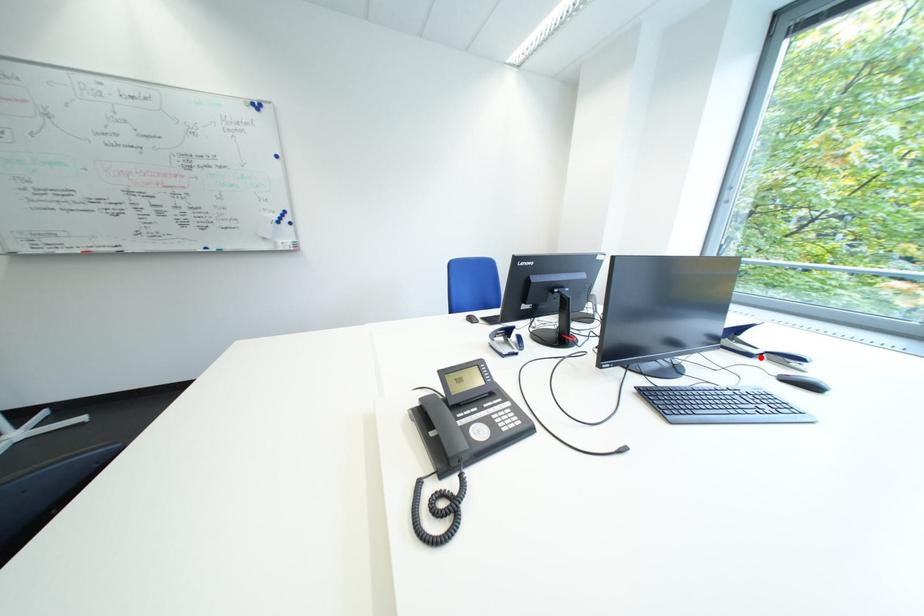
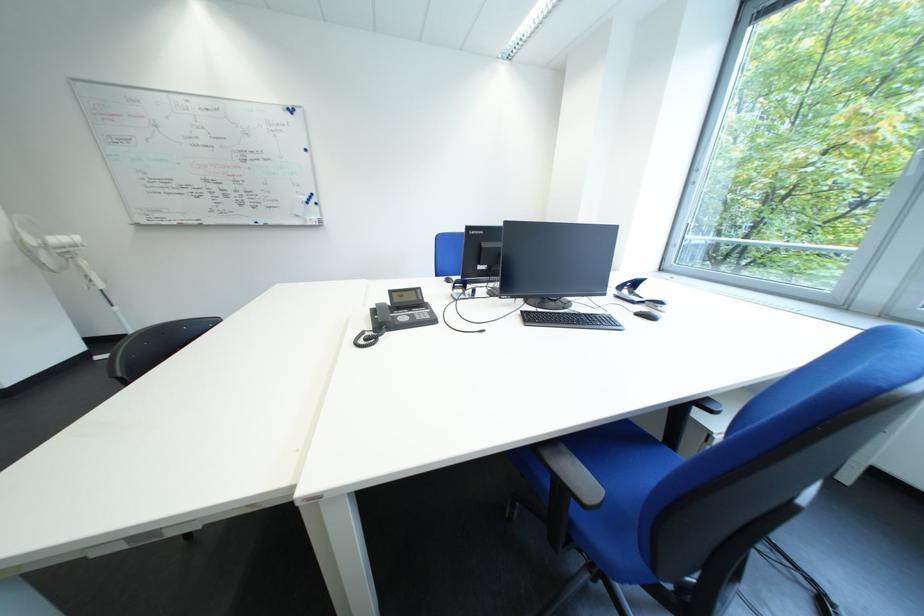
Locate, in the second image, the point that corresponds to the highlighted location in the first image.

(645, 305)